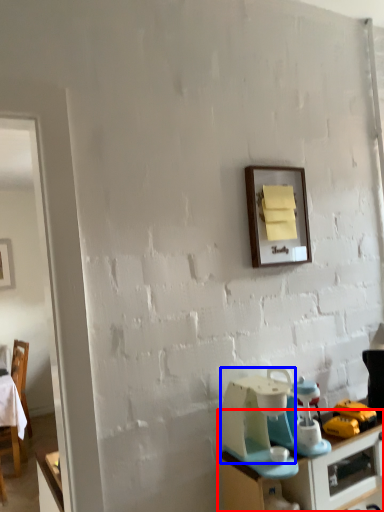
Question: Among these objects, which one is farthest to the camera, desk (highlighted by a red box) or appliance (highlighted by a blue box)?

Choices:
 (A) desk
 (B) appliance

Answer: (B)